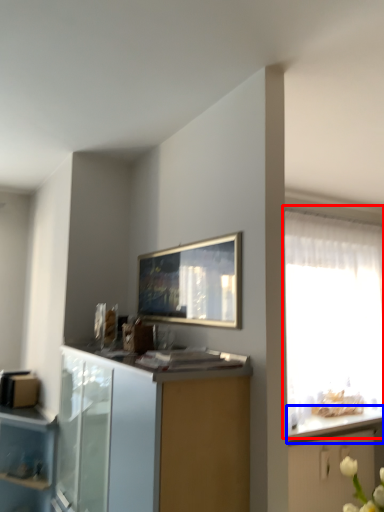
Question: Which point is closer to the camera, window (highlighted by a red box) or countertop (highlighted by a blue box)?

Choices:
 (A) window
 (B) countertop

Answer: (A)